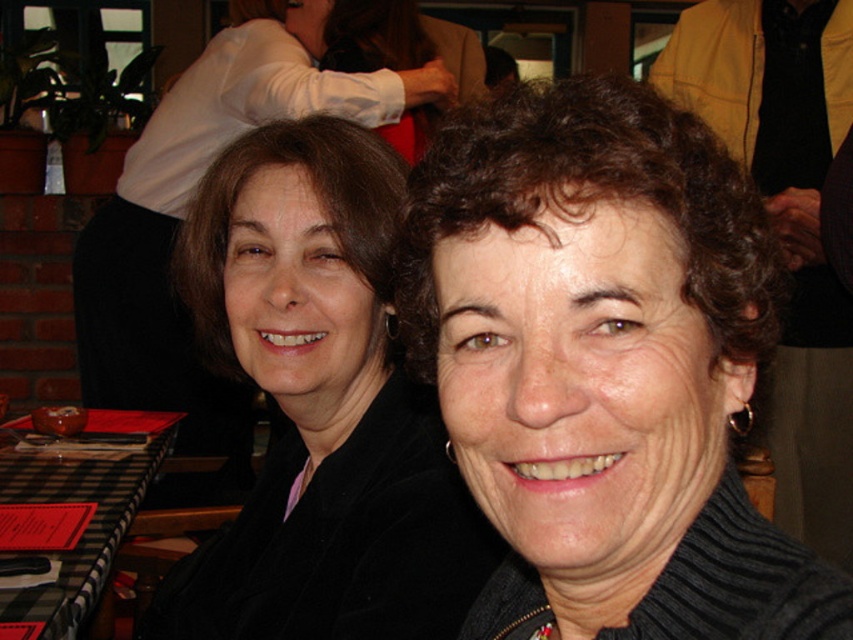
Question: Which object appears closest to the camera in this image?

Choices:
 (A) matte black jacket at upper left
 (B) black velvet jacket at upper left
 (C) dark brown curly hair at center
 (D) black checkered tablecloth at lower left

Answer: (C)

Question: Considering the real-world distances, which object is farthest from the black velvet jacket at upper left?

Choices:
 (A) dark brown curly hair at center
 (B) matte black jacket at upper left

Answer: (B)

Question: Can you confirm if dark brown curly hair at center is positioned below black velvet jacket at upper left?

Choices:
 (A) no
 (B) yes

Answer: (A)

Question: Can you confirm if matte black jacket at upper left is positioned to the left of black checkered tablecloth at lower left?

Choices:
 (A) yes
 (B) no

Answer: (B)

Question: Is matte black jacket at upper left thinner than black checkered tablecloth at lower left?

Choices:
 (A) no
 (B) yes

Answer: (A)

Question: Which of the following is the closest to the observer?

Choices:
 (A) black checkered tablecloth at lower left
 (B) dark brown curly hair at center
 (C) black velvet jacket at upper left

Answer: (B)